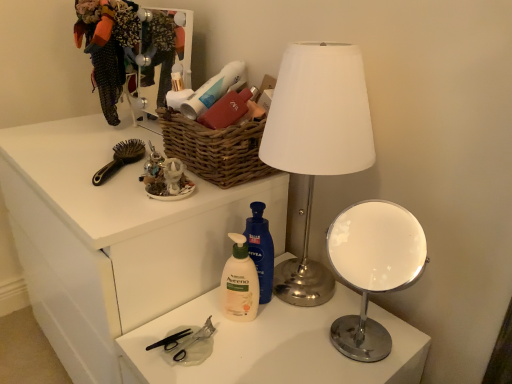
Question: Can you see white matte desk at center touching black plastic brush at upper left?

Choices:
 (A) no
 (B) yes

Answer: (A)

Question: Is white matte desk at center smaller than black plastic brush at upper left?

Choices:
 (A) no
 (B) yes

Answer: (A)

Question: Considering the relative positions of white matte desk at center and black plastic brush at upper left in the image provided, is white matte desk at center to the right of black plastic brush at upper left from the viewer's perspective?

Choices:
 (A) no
 (B) yes

Answer: (A)

Question: Considering the relative sizes of white matte desk at center and black plastic brush at upper left in the image provided, is white matte desk at center wider than black plastic brush at upper left?

Choices:
 (A) yes
 (B) no

Answer: (A)

Question: Can you confirm if white matte desk at center is taller than black plastic brush at upper left?

Choices:
 (A) no
 (B) yes

Answer: (B)

Question: Is metallic silver lamp at center taller or shorter than metallic silver mirror at upper center?

Choices:
 (A) tall
 (B) short

Answer: (A)

Question: From a real-world perspective, is metallic silver lamp at center above or below metallic silver mirror at upper center?

Choices:
 (A) below
 (B) above

Answer: (A)

Question: Is point coord(308,82) closer or farther from the camera than point coord(188,79)?

Choices:
 (A) farther
 (B) closer

Answer: (B)

Question: Considering the positions of metallic silver lamp at center and metallic silver mirror at upper center in the image, is metallic silver lamp at center bigger or smaller than metallic silver mirror at upper center?

Choices:
 (A) small
 (B) big

Answer: (B)

Question: Would you say black plastic scissors at lower center is to the left or to the right of patterned fabric dress at upper left in the picture?

Choices:
 (A) right
 (B) left

Answer: (A)

Question: Do you think black plastic scissors at lower center is within patterned fabric dress at upper left, or outside of it?

Choices:
 (A) outside
 (B) inside

Answer: (A)

Question: In terms of width, does black plastic scissors at lower center look wider or thinner when compared to patterned fabric dress at upper left?

Choices:
 (A) thin
 (B) wide

Answer: (A)

Question: Does point (170, 347) appear closer or farther from the camera than point (91, 3)?

Choices:
 (A) closer
 (B) farther

Answer: (A)

Question: Considering their positions, is woven brown basket at upper center located in front of or behind white matte desk at center?

Choices:
 (A) behind
 (B) front

Answer: (A)

Question: Based on their positions, is woven brown basket at upper center located to the left or right of white matte desk at center?

Choices:
 (A) left
 (B) right

Answer: (B)